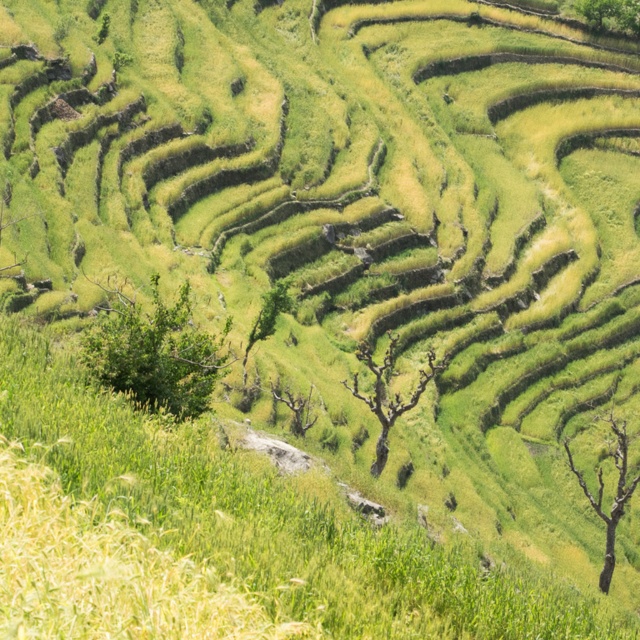
You are standing at the point labeled point (156, 353) in the terraced fields scene. What type of vegetation are you currently standing on?

The point (156, 353) is on a green leafy tree at center, so you are standing on a green leafy tree.

You are standing at the lower part of the terraced fields and want to walk towards the green leafy tree at center. Which direction should you move to reach it?

The green leafy tree at center is located at point (156, 353), which is to the upper part of the image. Since you are at the lower part, you should move upward to reach it.

You are standing at the bottom of the terraced fields and want to reach the first point you see. Which point would you head towards, point (618,497) or point (588,4)?

Point (618,497) is in front of point (588,4), so you should head towards point (618,497) first as it is closer to your current position.